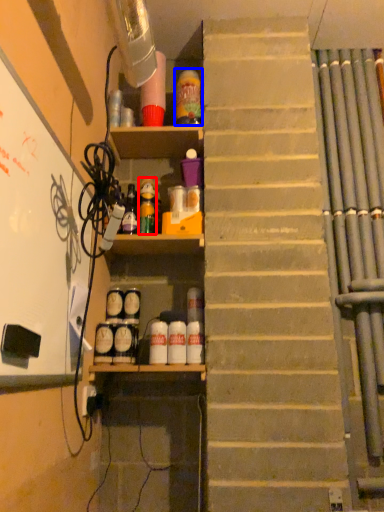
Question: Which point is closer to the camera, bottle (highlighted by a red box) or bottle (highlighted by a blue box)?

Choices:
 (A) bottle
 (B) bottle

Answer: (A)